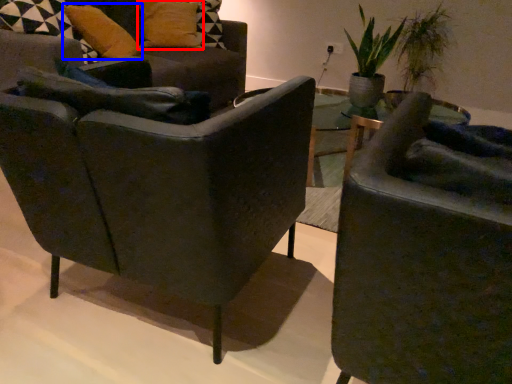
Question: Among these objects, which one is farthest to the camera, pillow (highlighted by a red box) or pillow (highlighted by a blue box)?

Choices:
 (A) pillow
 (B) pillow

Answer: (A)